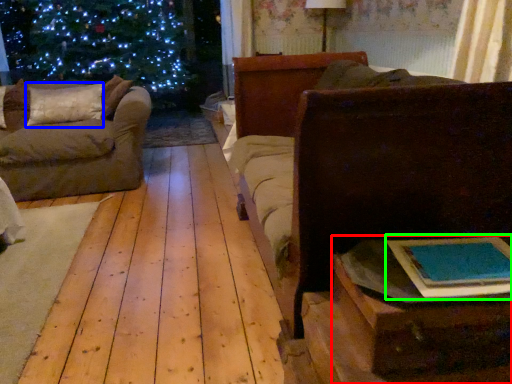
Question: Which is farther away from table (highlighted by a red box)? pillow (highlighted by a blue box) or book (highlighted by a green box)?

Choices:
 (A) pillow
 (B) book

Answer: (A)